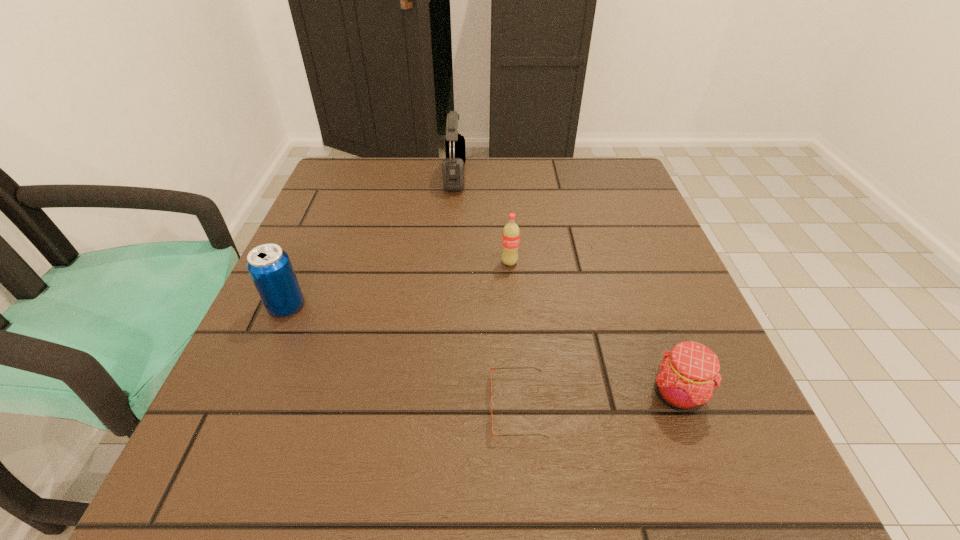
Where is `blank area located on the back of the nearer soda`? The height and width of the screenshot is (540, 960). blank area located on the back of the nearer soda is located at coordinates (330, 207).

What are the coordinates of `vacant space located on the front of the farther soda` in the screenshot? It's located at (516, 342).

The width and height of the screenshot is (960, 540). Identify the location of free region located 0.130m on the back of the second shortest object. (646, 311).

At what (x,y) coordinates should I click in order to perform the action: click on vacant region located 0.340m on the face of the shortest object. Please return your answer as a coordinate pair (x, y). Looking at the image, I should click on (266, 406).

Find the location of a particular element. The image size is (960, 540). vacant region located on the face of the shortest object is located at coordinates (273, 406).

This screenshot has width=960, height=540. Find the location of `blank space located 0.250m on the face of the shortest object`. blank space located 0.250m on the face of the shortest object is located at coordinates coord(325,406).

This screenshot has height=540, width=960. Find the location of `object that is at the far edge`. object that is at the far edge is located at coordinates (453, 165).

Find the location of a particular element. The width and height of the screenshot is (960, 540). object at the left edge is located at coordinates (270, 268).

At what (x,y) coordinates should I click in order to perform the action: click on object located in the right edge section of the desktop. Please return your answer as a coordinate pair (x, y). The width and height of the screenshot is (960, 540). Looking at the image, I should click on (686, 378).

Locate an element on the screen. Image resolution: width=960 pixels, height=540 pixels. vacant space at the far edge of the desktop is located at coordinates pyautogui.click(x=477, y=204).